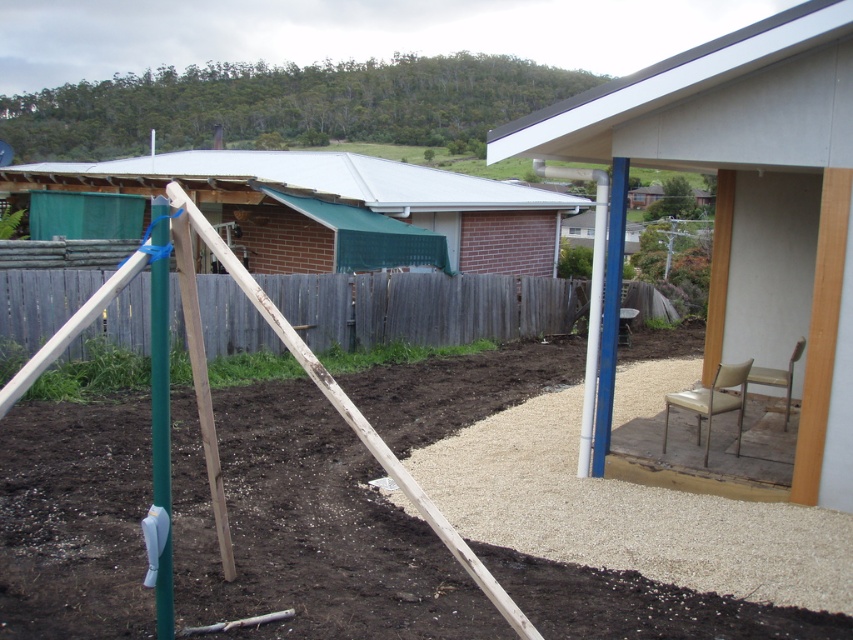
You are planning to install a new 10 feet wide garden bed between the smooth white wall at upper right and the gray wood fence at center. Is there enough space for it?

The smooth white wall at upper right is 29.14 feet from the gray wood fence at center, so yes, there is enough space to install a 10 feet wide garden bed between them since the distance is greater than the required width.

You are standing in the backyard looking at the construction area. There are two points marked in the scene, one at coordinate point (737,182) and the other at point (22,298). Which point is closer to your current position?

Point (22,298) is closer to your current position because it is less further to the camera than point (737,182).

You are standing at the point marked as point (322,209) in the backyard. What structure is located at that exact point?

The metal brick hut at upper left is located at point (322,209).